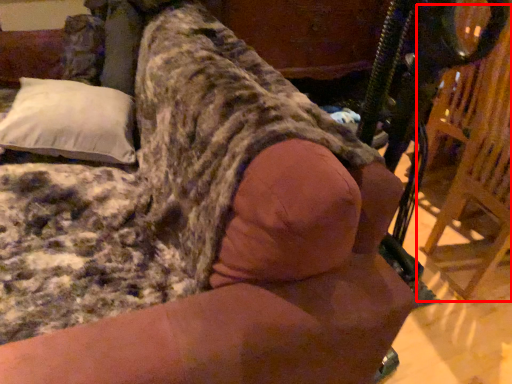
Question: Where is swivel chair (annotated by the red box) located in relation to pillow in the image?

Choices:
 (A) left
 (B) right

Answer: (B)